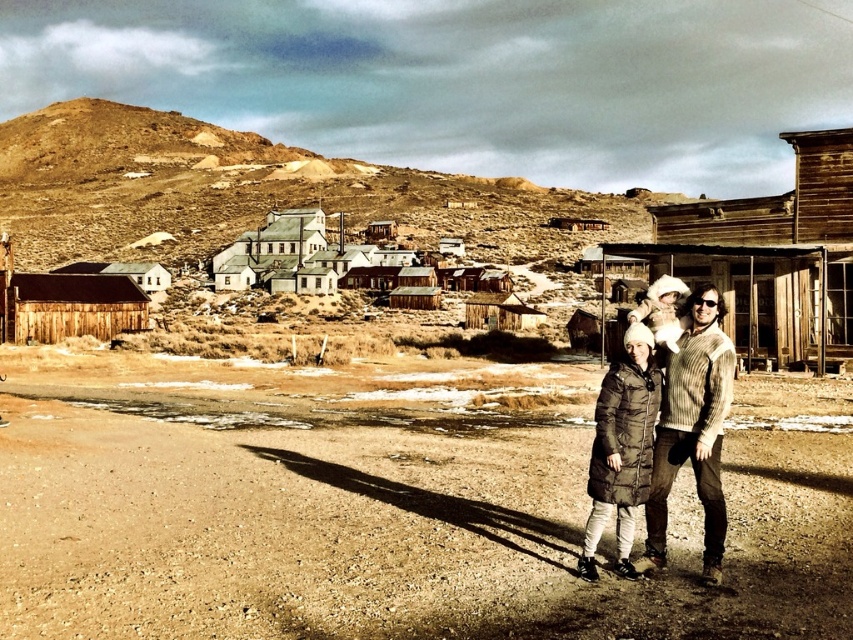
Question: Which of these objects is positioned closest to the wooden shack at left?

Choices:
 (A) wooden buildings at center
 (B) brown puffy coat at lower right

Answer: (A)

Question: Which of these objects is positioned closest to the brown puffy coat at lower right?

Choices:
 (A) wooden buildings at center
 (B) brown dirt field at lower center
 (C) wooden hut at center-right
 (D) rustic wooden hut at center

Answer: (B)

Question: Which point is farther to the camera?

Choices:
 (A) (x=242, y=273)
 (B) (x=62, y=337)
 (C) (x=689, y=316)
 (D) (x=682, y=221)

Answer: (A)

Question: Is brown dirt field at lower center thinner than wooden buildings at center?

Choices:
 (A) no
 (B) yes

Answer: (A)

Question: Is wooden hut at center-right above wooden hut at center?

Choices:
 (A) yes
 (B) no

Answer: (A)

Question: Can you confirm if wooden buildings at center is positioned to the right of wooden hut at center?

Choices:
 (A) no
 (B) yes

Answer: (A)